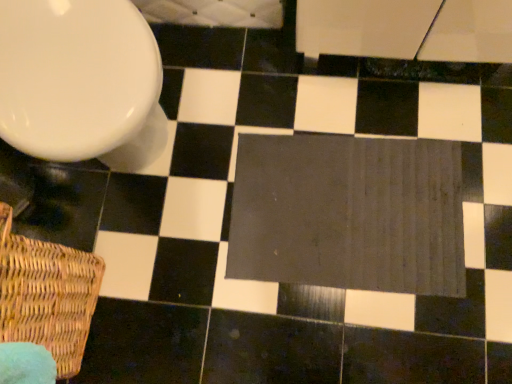
Where is `vacant area that is situated to the right of dark gray fabric bath mat at center`? vacant area that is situated to the right of dark gray fabric bath mat at center is located at coordinates (461, 153).